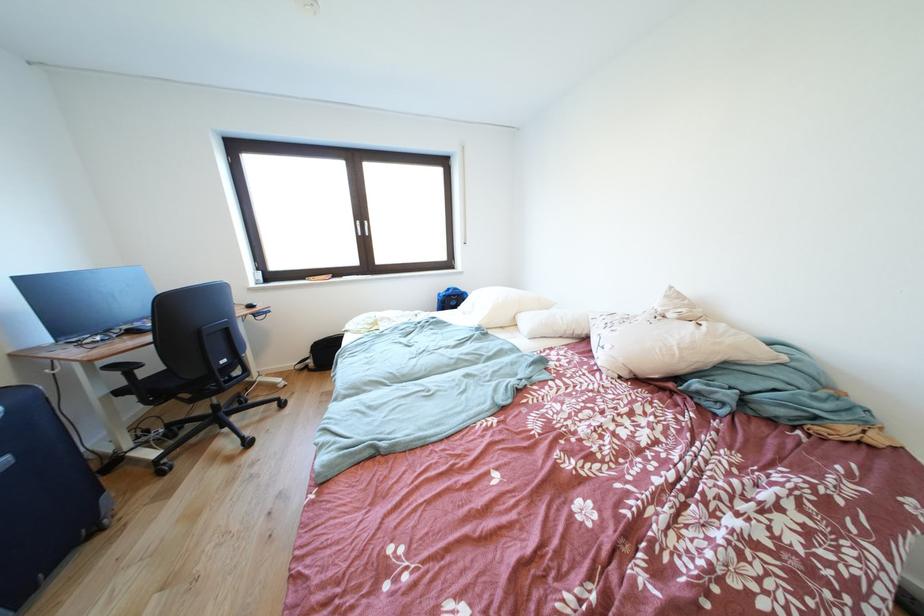
The height and width of the screenshot is (616, 924). Describe the element at coordinates (321, 354) in the screenshot. I see `the black backpack` at that location.